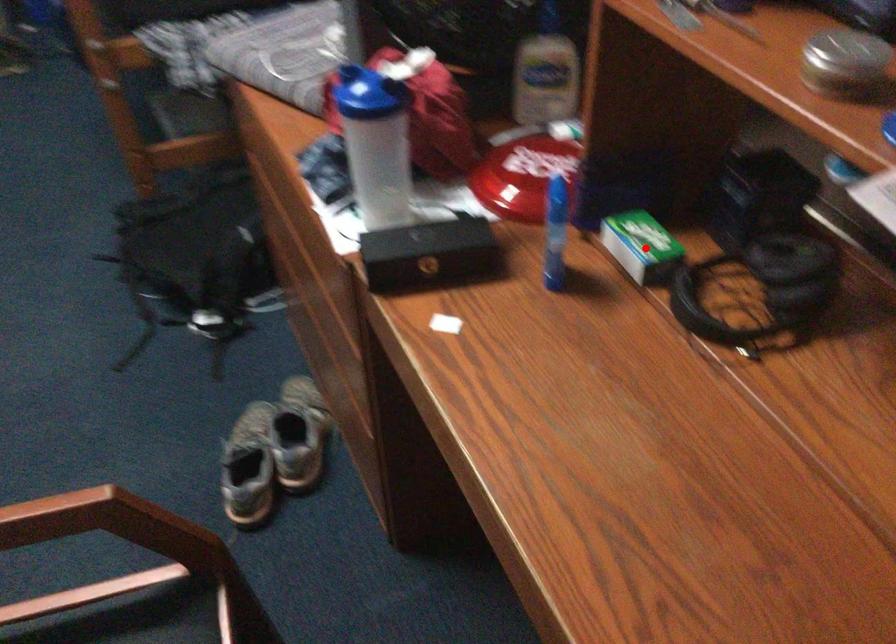
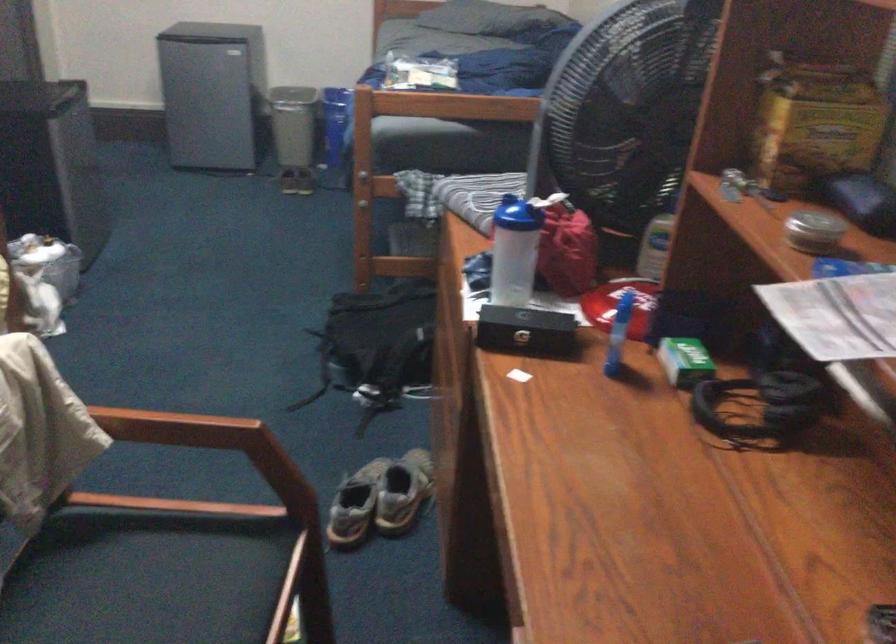
Question: I am providing you with two images of the same scene from different viewpoints. Image1 has a red point marked. In image2, the corresponding 3D location appears at what relative position? Reply with the corresponding letter.

Choices:
 (A) Closer
 (B) Farther

Answer: (B)